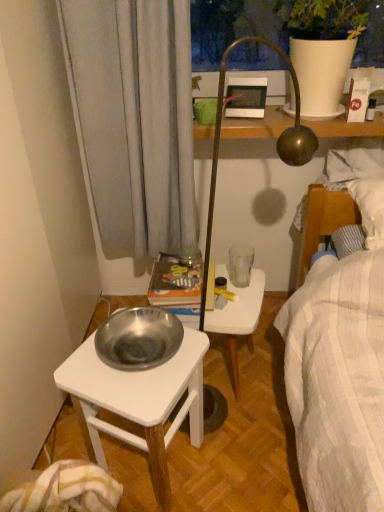
You are a GUI agent. You are given a task and a screenshot of the screen. Output one action in this format:
    pyautogui.click(x=<x>, y=<y>)
    Task: Click on the free space above white plastic stool at center (from a real-world perspective)
    Image resolution: width=384 pixels, height=512 pixels.
    Given the screenshot: What is the action you would take?
    pyautogui.click(x=236, y=294)